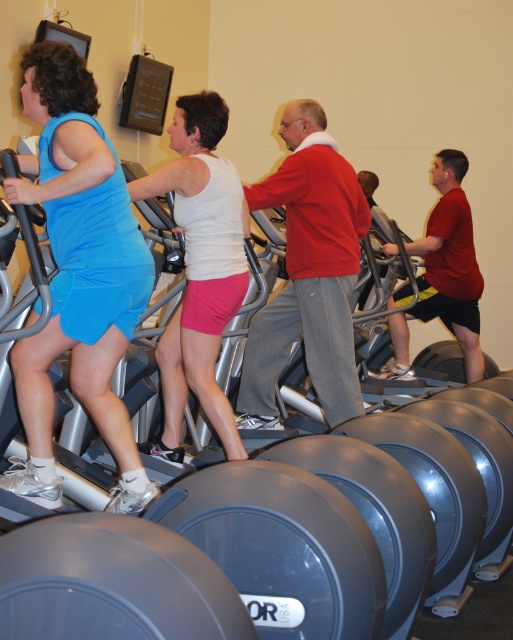
Question: Which object appears farthest from the camera in this image?

Choices:
 (A) red cotton sweater at center
 (B) white matte tank top at center
 (C) matte blue dress at left

Answer: (A)

Question: Which object appears closest to the camera in this image?

Choices:
 (A) white matte tank top at center
 (B) matte blue dress at left

Answer: (B)

Question: Is matte blue dress at left positioned at the back of white matte tank top at center?

Choices:
 (A) yes
 (B) no

Answer: (B)

Question: Can you confirm if matte blue dress at left is smaller than white matte tank top at center?

Choices:
 (A) no
 (B) yes

Answer: (A)

Question: Is red cotton sweater at center wider than white matte tank top at center?

Choices:
 (A) yes
 (B) no

Answer: (A)

Question: Which point is farther from the camera taking this photo?

Choices:
 (A) (332, 307)
 (B) (32, 360)

Answer: (A)